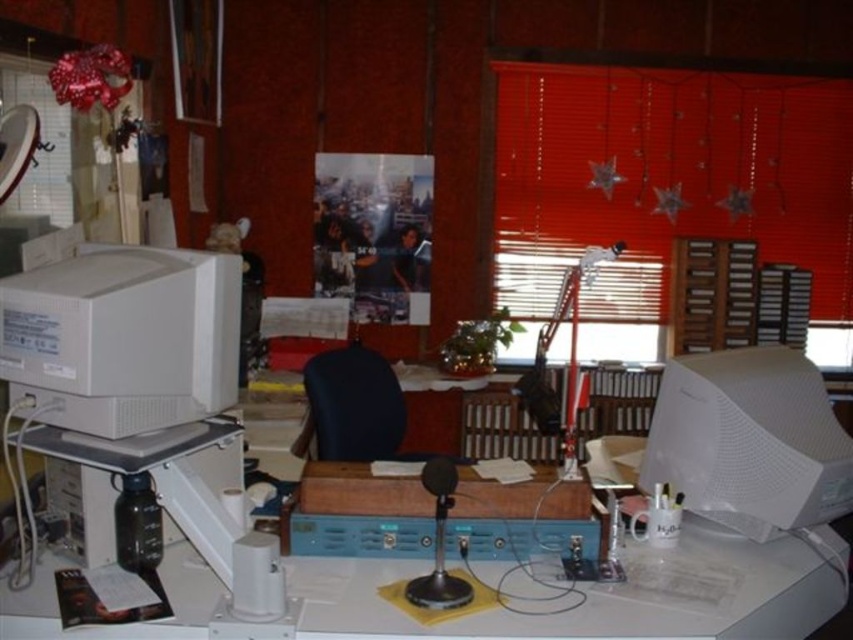
Is point (815, 445) farther from camera compared to point (318, 396)?

No, it is in front of (318, 396).

Is white matte computer monitor at right above black leather chair at center?

Indeed, white matte computer monitor at right is positioned over black leather chair at center.

Does point (808, 509) come behind point (374, 442)?

No, (808, 509) is in front of (374, 442).

Where is `white matte computer monitor at right`? This screenshot has width=853, height=640. white matte computer monitor at right is located at coordinates (749, 440).

Can you confirm if white matte desktop computer at left is positioned to the left of white matte computer monitor at right?

Indeed, white matte desktop computer at left is positioned on the left side of white matte computer monitor at right.

Between point (204, 268) and point (735, 454), which one is positioned in front?

Point (204, 268) is more forward.

Find the location of a particular element. This screenshot has width=853, height=640. white matte desktop computer at left is located at coordinates (123, 337).

This screenshot has width=853, height=640. I want to click on white matte desktop computer at left, so pos(123,337).

Is white matte desktop computer at left shorter than black leather chair at center?

Yes, white matte desktop computer at left is shorter than black leather chair at center.

Which is behind, point (131, 426) or point (323, 368)?

The point (323, 368) is behind.

Where is `white matte desktop computer at left`? white matte desktop computer at left is located at coordinates (123, 337).